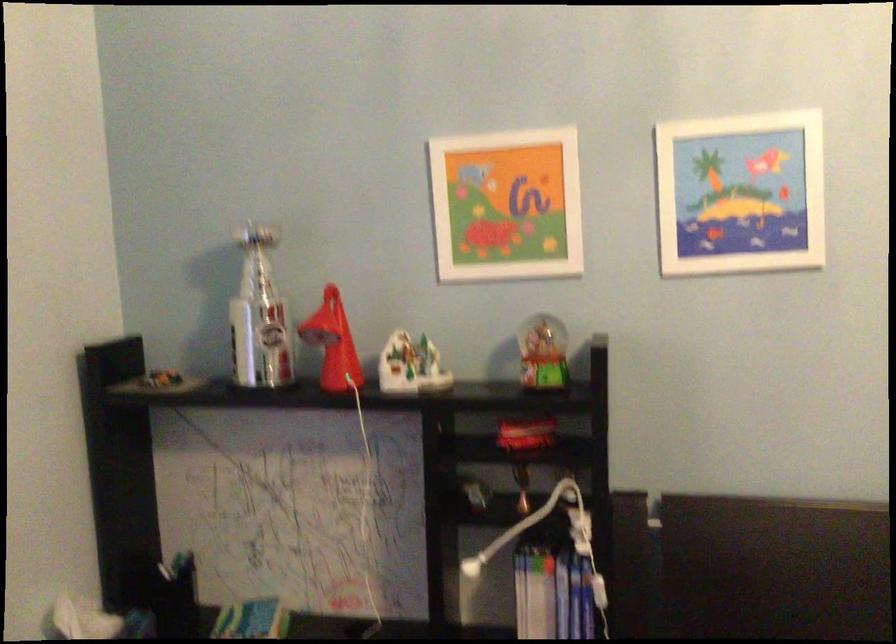
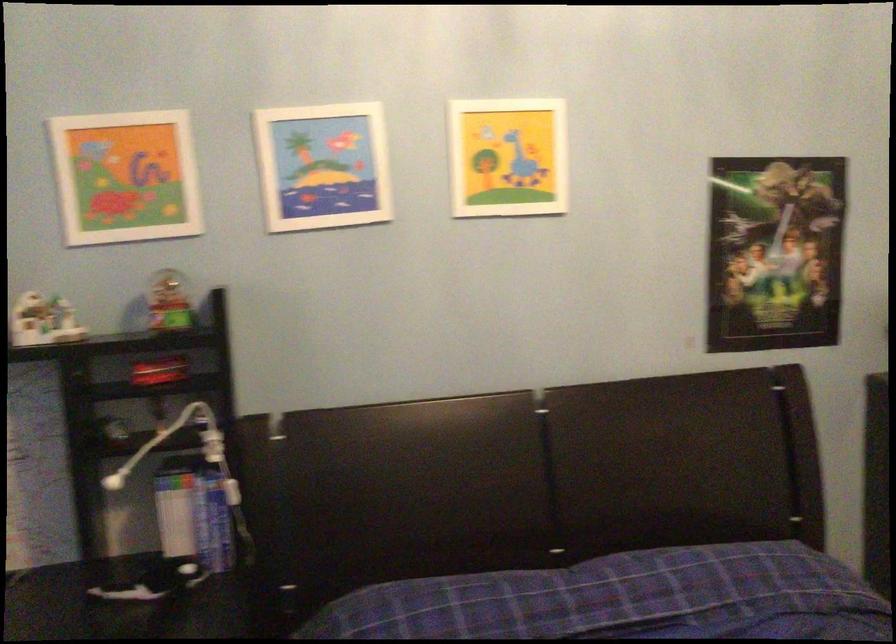
Question: The camera is either moving clockwise (left) or counter-clockwise (right) around the object. The first image is from the beginning of the video and the second image is from the end. Is the camera moving left or right when shooting the video?

Choices:
 (A) Left
 (B) Right

Answer: (A)